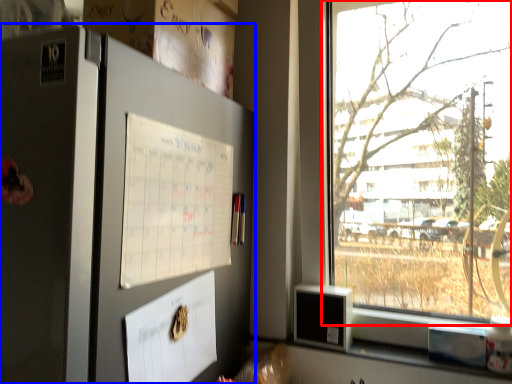
Question: Which point is further to the camera, window (highlighted by a red box) or fridge (highlighted by a blue box)?

Choices:
 (A) window
 (B) fridge

Answer: (A)